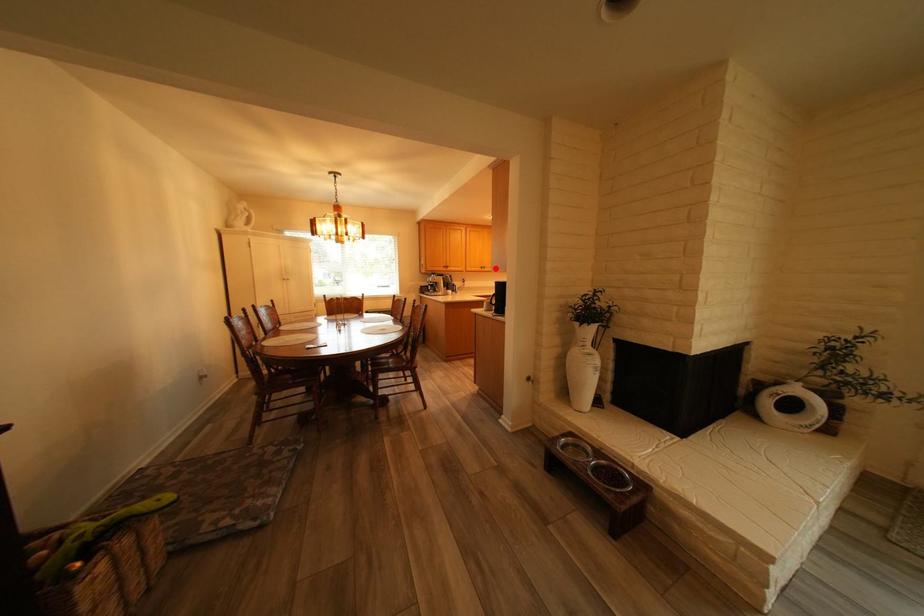
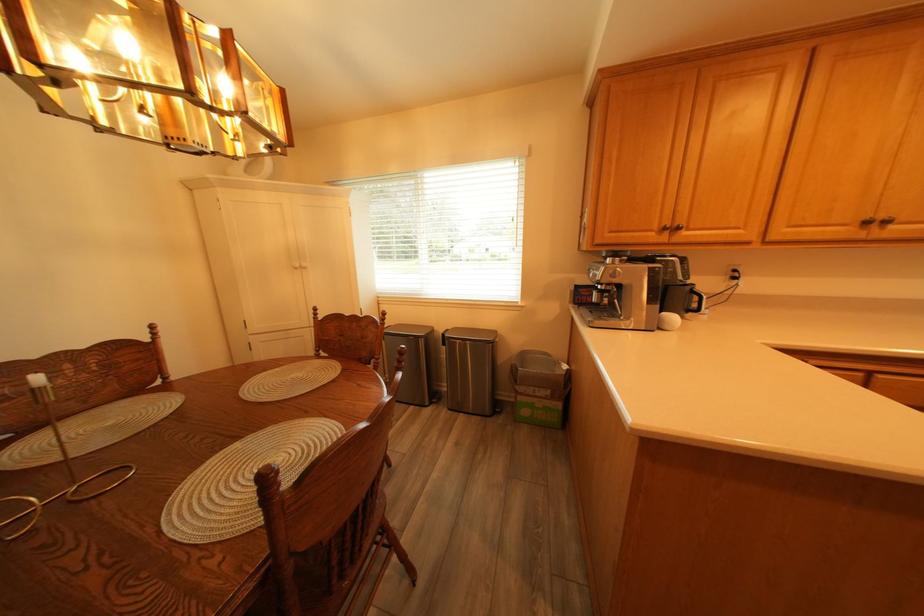
The point at the highlighted location is marked in the first image. Where is the corresponding point in the second image?

(881, 224)